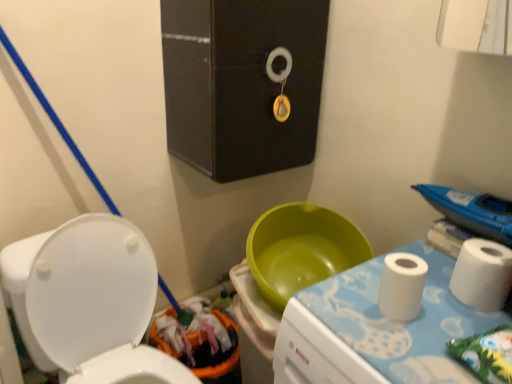
Question: From the image's perspective, is orange fabric potty at lower left located above or below white paper towel at right?

Choices:
 (A) above
 (B) below

Answer: (B)

Question: In terms of size, does orange fabric potty at lower left appear bigger or smaller than white paper towel at right?

Choices:
 (A) big
 (B) small

Answer: (A)

Question: Estimate the real-world distances between objects in this image. Which object is closer to the white fabric changing table at right?

Choices:
 (A) orange fabric potty at lower left
 (B) white paper towel at right
 (C) white glossy toilet at lower left
 (D) white matte toilet paper at right
 (E) white matte toilet paper at right

Answer: (E)

Question: Based on their relative distances, which object is farther from the black matte medicine cabinet at upper center?

Choices:
 (A) white matte toilet paper at right
 (B) white fabric changing table at right
 (C) white matte toilet paper at right
 (D) orange fabric potty at lower left
 (E) white paper towel at right

Answer: (A)